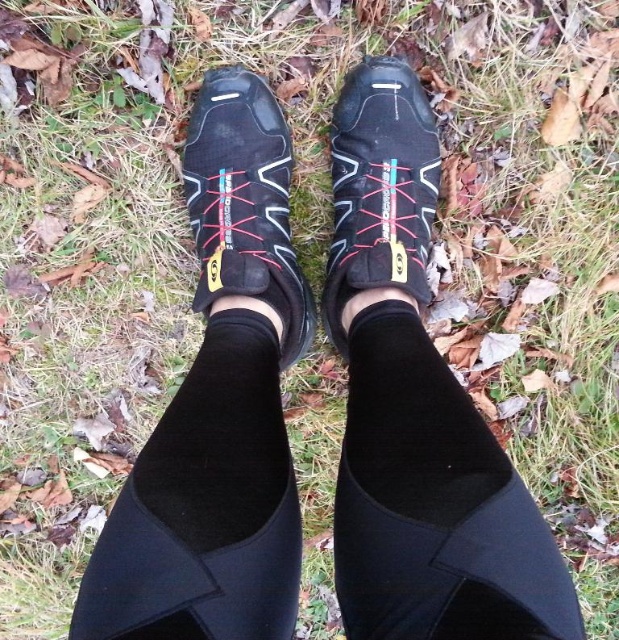
You are a hiker preparing for a trail walk and notice your black spandex sock at center and black mesh shoe at center. Which item is more likely to be worn underneath the other?

The black spandex sock at center is thinner than the black mesh shoe at center, so the black spandex sock at center is likely worn underneath the black mesh shoe at center.

You are a hiker who wants to check if your black spandex sock at center is properly covered by your black mesh shoe at center to prevent blisters. Based on the scene, can you confirm if the sock is fully covered by the shoe?

The black spandex sock at center is below black mesh shoe at center, so yes, the sock is fully covered by the shoe, which should help prevent blisters.

You are trying to determine the best way to pack your hiking gear for a trip. You have a small compartment in your backpack where you want to place both the black spandex sock at center and the matte black shoe at center. Given their sizes, which item should you place first to ensure both fit properly?

Since the black spandex sock at center has a lesser width compared to the matte black shoe at center, you should place the matte black shoe at center first in the compartment, then the black spandex sock at center to ensure proper fit.